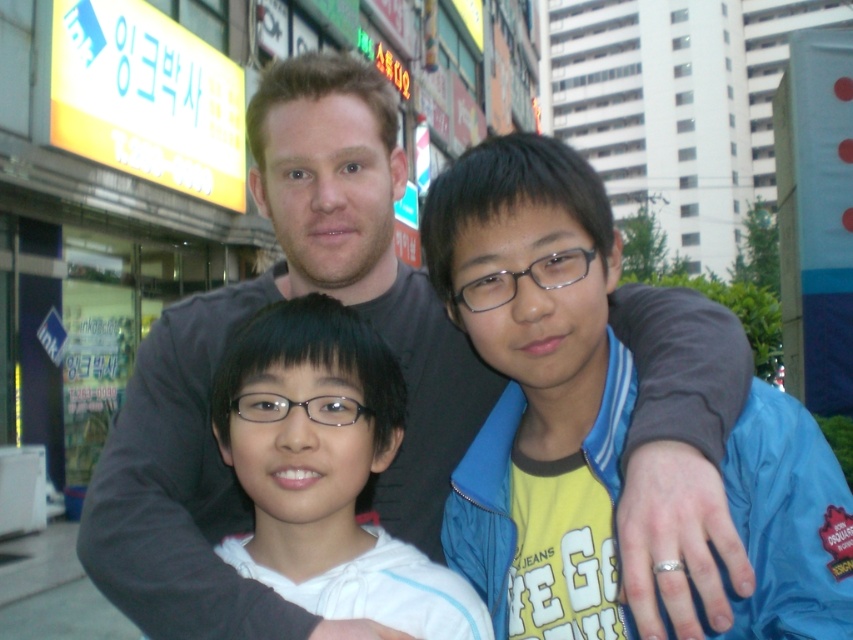
Which of these two, gray matte shirt at center or blue fabric jacket at center, stands taller?

gray matte shirt at center

Can you confirm if gray matte shirt at center is positioned above blue fabric jacket at center?

Yes, gray matte shirt at center is above blue fabric jacket at center.

Who is more distant from viewer, (463, 388) or (769, 451)?

The point (463, 388) is behind.

You are a GUI agent. You are given a task and a screenshot of the screen. Output one action in this format:
    pyautogui.click(x=<x>, y=<y>)
    Task: Click on the gray matte shirt at center
    
    Given the screenshot: What is the action you would take?
    pyautogui.click(x=219, y=355)

What do you see at coordinates (219, 355) in the screenshot? Image resolution: width=853 pixels, height=640 pixels. I see `gray matte shirt at center` at bounding box center [219, 355].

Is gray matte shirt at center positioned in front of white matte hoodie at center?

Yes, gray matte shirt at center is closer to the viewer.

What are the coordinates of `gray matte shirt at center` in the screenshot? It's located at (219, 355).

Find the location of a particular element. The image size is (853, 640). gray matte shirt at center is located at coordinates (219, 355).

Between point (492, 618) and point (300, 424), which one is positioned behind?

The point (492, 618) is behind.

This screenshot has width=853, height=640. Describe the element at coordinates (534, 378) in the screenshot. I see `blue fabric jacket at center` at that location.

This screenshot has width=853, height=640. What are the coordinates of `blue fabric jacket at center` in the screenshot? It's located at (534, 378).